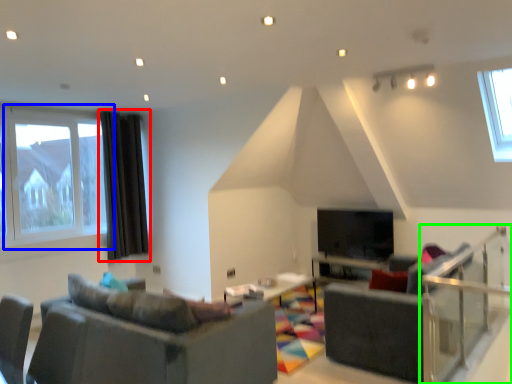
Question: Which object is the farthest from curtain (highlighted by a red box)? Choose among these: window (highlighted by a blue box) or balustrade (highlighted by a green box).

Choices:
 (A) window
 (B) balustrade

Answer: (B)